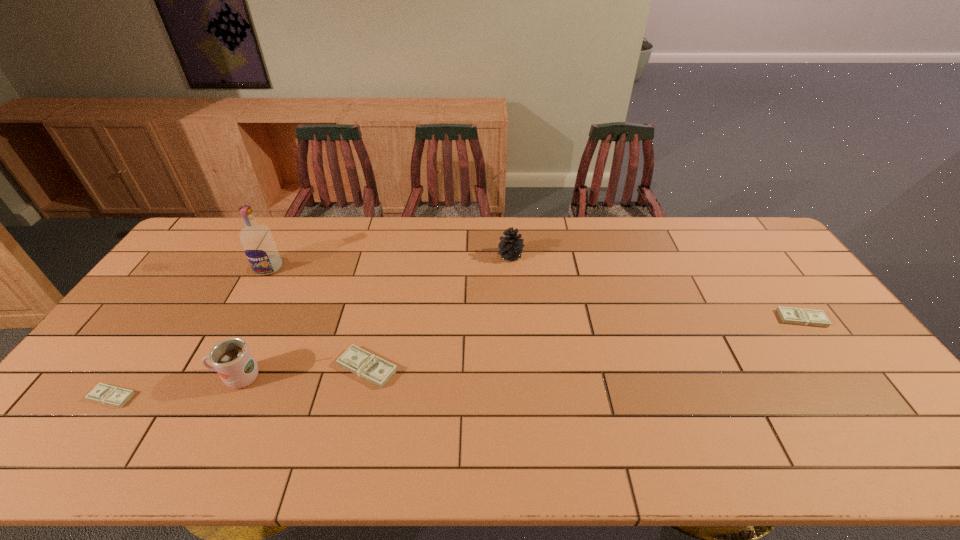
This screenshot has width=960, height=540. What are the coordinates of `location for an additional money to make spacing equal` in the screenshot? It's located at (596, 342).